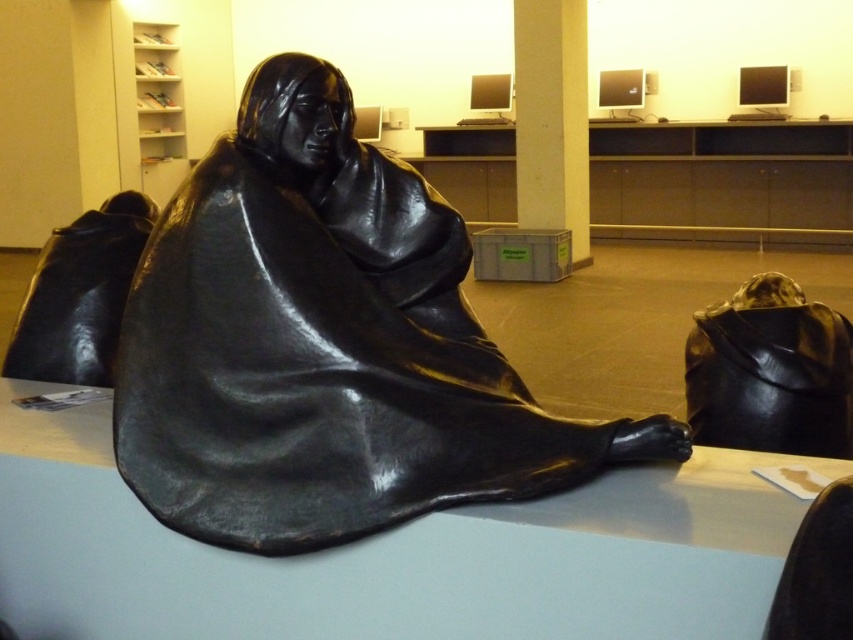
Question: Is shiny black statue at center above glossy black table at center?

Choices:
 (A) no
 (B) yes

Answer: (B)

Question: Which point is farther to the camera?

Choices:
 (A) (526, 19)
 (B) (51, 445)

Answer: (A)

Question: Which object appears closest to the camera in this image?

Choices:
 (A) white matte pillar at upper center
 (B) shiny black statue at center
 (C) glossy black table at center

Answer: (C)

Question: From the image, what is the correct spatial relationship of shiny black statue at center in relation to white matte pillar at upper center?

Choices:
 (A) above
 (B) below

Answer: (B)

Question: Is shiny black statue at center closer to the viewer compared to white matte pillar at upper center?

Choices:
 (A) yes
 (B) no

Answer: (A)

Question: Which point is closer to the camera?

Choices:
 (A) (519, 118)
 (B) (206, 506)

Answer: (B)